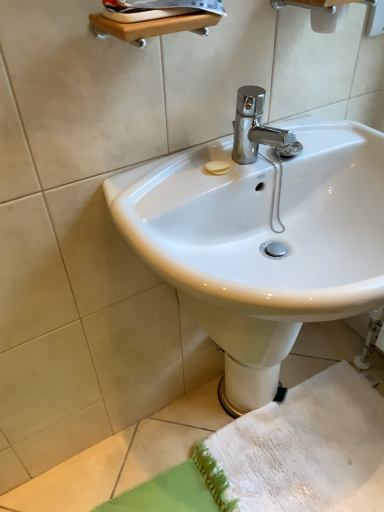
Question: Is white textured towel at lower right at the back of white glossy bidet at lower center?

Choices:
 (A) yes
 (B) no

Answer: (B)

Question: Is white glossy bidet at lower center behind white textured towel at lower right?

Choices:
 (A) no
 (B) yes

Answer: (B)

Question: Are white glossy bidet at lower center and white textured towel at lower right beside each other?

Choices:
 (A) no
 (B) yes

Answer: (A)

Question: Is white glossy bidet at lower center shorter than white textured towel at lower right?

Choices:
 (A) no
 (B) yes

Answer: (A)

Question: Is white glossy bidet at lower center located outside white textured towel at lower right?

Choices:
 (A) yes
 (B) no

Answer: (A)

Question: From the image's perspective, would you say white glossy bidet at lower center is positioned over white textured towel at lower right?

Choices:
 (A) no
 (B) yes

Answer: (B)

Question: From the image's perspective, is white glossy sink at center located above white glossy bidet at lower center?

Choices:
 (A) no
 (B) yes

Answer: (B)

Question: Does white glossy sink at center have a greater width compared to white glossy bidet at lower center?

Choices:
 (A) no
 (B) yes

Answer: (B)

Question: Is white glossy sink at center closer to the viewer compared to white glossy bidet at lower center?

Choices:
 (A) yes
 (B) no

Answer: (A)

Question: Can we say white glossy sink at center lies outside white glossy bidet at lower center?

Choices:
 (A) yes
 (B) no

Answer: (A)

Question: Is white glossy sink at center looking in the opposite direction of white glossy bidet at lower center?

Choices:
 (A) no
 (B) yes

Answer: (A)

Question: Considering the relative sizes of white glossy sink at center and white glossy bidet at lower center in the image provided, is white glossy sink at center shorter than white glossy bidet at lower center?

Choices:
 (A) no
 (B) yes

Answer: (A)

Question: Can you confirm if white glossy sink at center is positioned to the left of white textured towel at lower right?

Choices:
 (A) yes
 (B) no

Answer: (A)